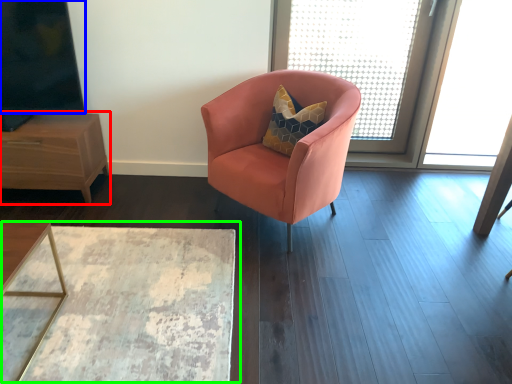
Question: Which is farther away from nightstand (highlighted by a red box)? window screen (highlighted by a blue box) or table (highlighted by a green box)?

Choices:
 (A) window screen
 (B) table

Answer: (B)